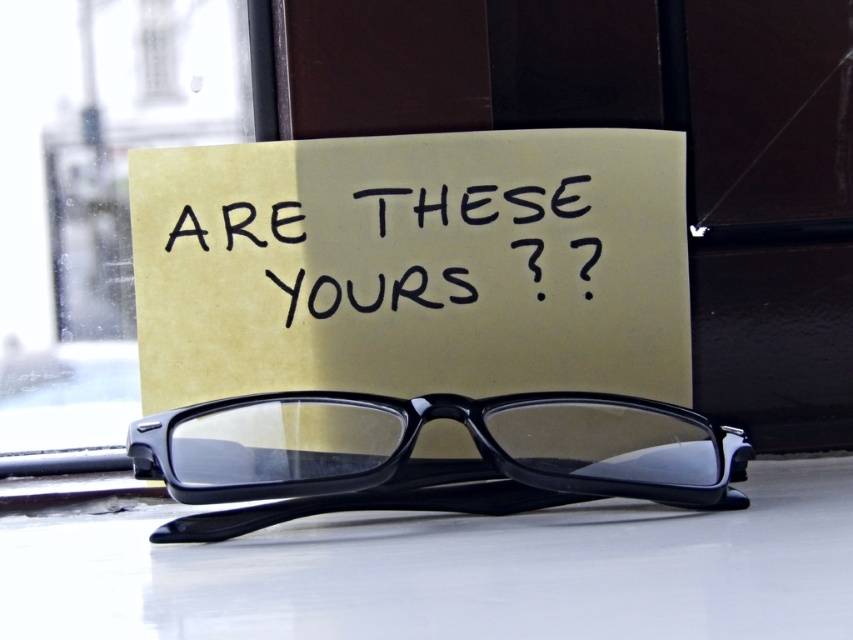
You are organizing items on a desk and need to place a new object at coordinates 0.4, 0.48. Is there enough space between the yellow paper at center and the edge of the desk to place it there?

The yellow paper at center is located at point (x=413, y=266). Since the new object is at (x=409, y=256), which is very close but slightly to the left and slightly lower, there might be enough space depending on the size of the object. However, the exact distance isn

You are trying to read the text on the yellow paper at center and the black handwritten text at center. Which one appears larger to you?

The yellow paper at center is closer to the viewer than the black handwritten text at center, so the yellow paper at center appears larger.

You are trying to place a 3.5 inch wide decorative item on the reflective surface where the yellow paper at center and black plastic glasses at center are located. Can both items fit without overlapping?

The yellow paper at center and black plastic glasses at center are 2.96 inches apart from each other. Since the decorative item is 3.5 inches wide, it would overlap with at least one of the items when placed between them, so they cannot both fit without overlapping.